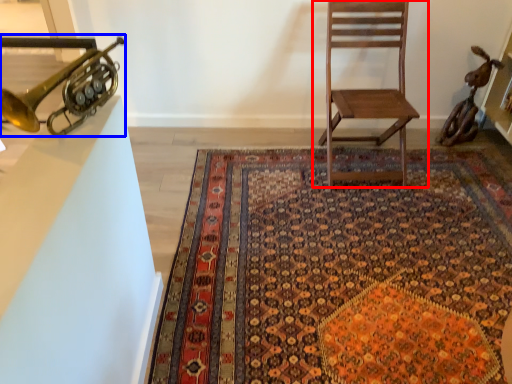
Question: Which point is closer to the camera, chair (highlighted by a red box) or trumpet (highlighted by a blue box)?

Choices:
 (A) chair
 (B) trumpet

Answer: (B)